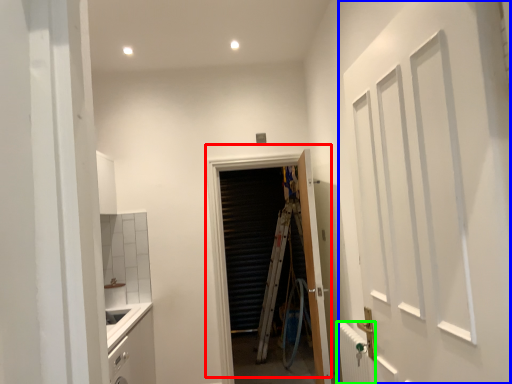
Question: Which object is positioned farthest from door (highlighted by a red box)? Select from door (highlighted by a blue box) and radiator (highlighted by a green box).

Choices:
 (A) door
 (B) radiator

Answer: (A)